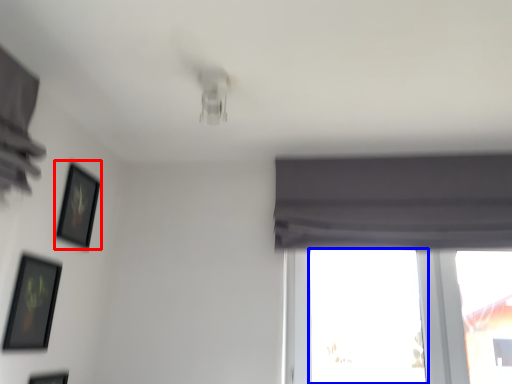
Question: Among these objects, which one is farthest to the camera, picture frame (highlighted by a red box) or window (highlighted by a blue box)?

Choices:
 (A) picture frame
 (B) window

Answer: (B)